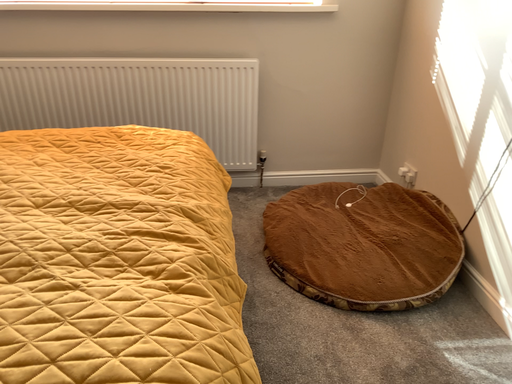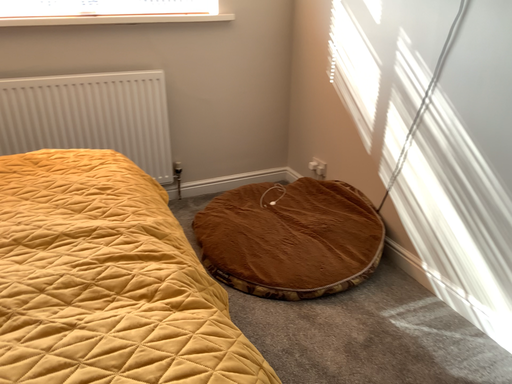
Question: Which way did the camera rotate in the video?

Choices:
 (A) rotated left
 (B) rotated right

Answer: (B)